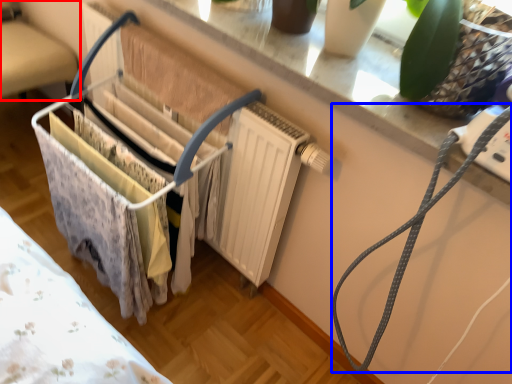
Question: Which object is closer to the camera taking this photo, furniture (highlighted by a red box) or string (highlighted by a blue box)?

Choices:
 (A) furniture
 (B) string

Answer: (B)